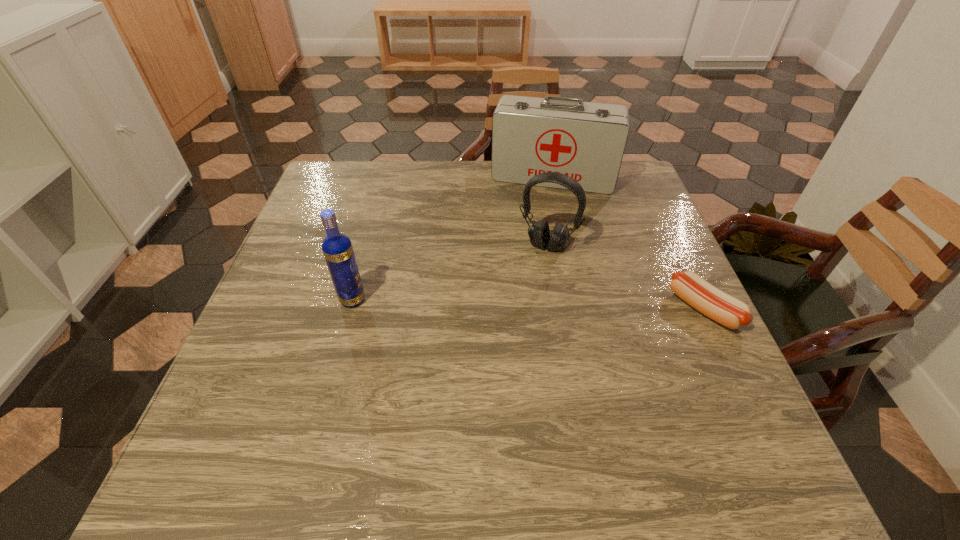
The height and width of the screenshot is (540, 960). Identify the location of free point between the rightmost object and the first-aid kit. (628, 243).

At what (x,y) coordinates should I click in order to perform the action: click on unoccupied area between the second farthest object and the farthest object. Please return your answer as a coordinate pair (x, y). The width and height of the screenshot is (960, 540). Looking at the image, I should click on (550, 211).

Find the location of a particular element. free area in between the third nearest object and the first-aid kit is located at coordinates (550, 211).

I want to click on the second closest object relative to the first-aid kit, so click(728, 311).

The image size is (960, 540). Find the location of `object that is the closest to the second farthest object`. object that is the closest to the second farthest object is located at coordinates (586, 141).

Find the location of a particular element. The height and width of the screenshot is (540, 960). vacant space that satisfies the following two spatial constraints: 1. on the back side of the first-aid kit; 2. on the right side of the second farthest object is located at coordinates (537, 178).

Locate an element on the screen. free point that satisfies the following two spatial constraints: 1. on the back side of the second farthest object; 2. on the right side of the leftmost object is located at coordinates (368, 245).

The height and width of the screenshot is (540, 960). I want to click on free space that satisfies the following two spatial constraints: 1. on the front side of the rightmost object; 2. on the right side of the leftmost object, so click(x=350, y=308).